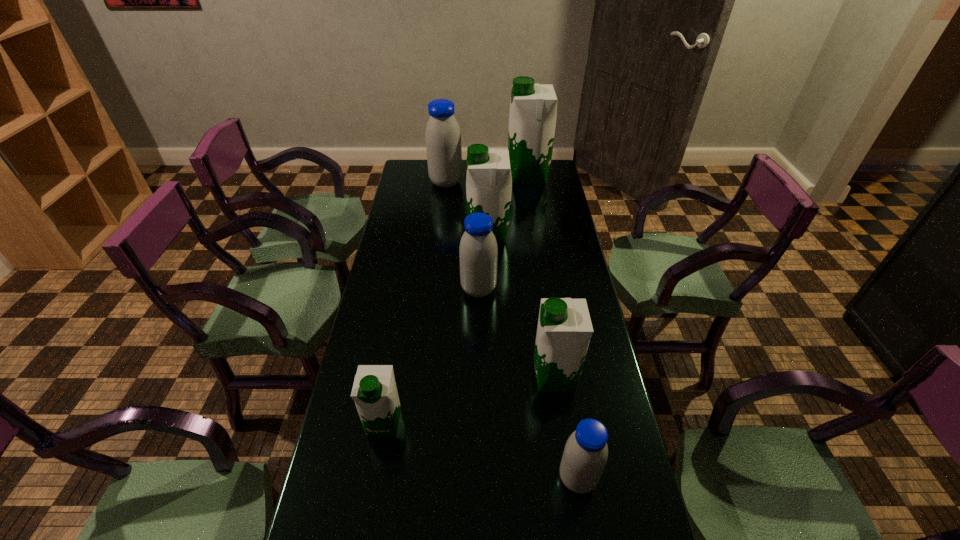
Find the location of a particular element. Image resolution: width=960 pixels, height=540 pixels. the tallest object is located at coordinates (533, 107).

This screenshot has width=960, height=540. I want to click on the biggest green soya milk, so click(x=533, y=107).

Image resolution: width=960 pixels, height=540 pixels. I want to click on the third green soya milk from right to left, so click(x=488, y=182).

The width and height of the screenshot is (960, 540). I want to click on the third smallest green soya milk, so click(x=488, y=182).

Identify the location of the farthest blue soya milk. (443, 137).

Identify the location of the leftmost blue soya milk. (443, 137).

I want to click on the third nearest soya milk, so click(x=564, y=330).

The height and width of the screenshot is (540, 960). What are the coordinates of `the second nearest green soya milk` in the screenshot? It's located at (564, 330).

This screenshot has width=960, height=540. In order to click on the second farthest blue soya milk in this screenshot , I will do `click(478, 252)`.

Locate an element on the screen. The image size is (960, 540). the second biggest blue soya milk is located at coordinates (478, 252).